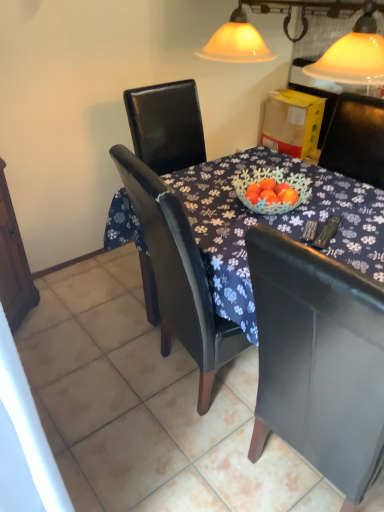
Question: Is point (322, 413) positioned closer to the camera than point (221, 187)?

Choices:
 (A) closer
 (B) farther

Answer: (A)

Question: In terms of width, does black leather chair at center look wider or thinner when compared to dark wood table at center?

Choices:
 (A) wide
 (B) thin

Answer: (B)

Question: Visually, is black leather chair at center positioned to the left or to the right of dark wood table at center?

Choices:
 (A) right
 (B) left

Answer: (A)

Question: In terms of height, does dark wood table at center look taller or shorter compared to black leather chair at center?

Choices:
 (A) tall
 (B) short

Answer: (B)

Question: Visually, is dark wood table at center positioned to the left or to the right of black leather chair at center?

Choices:
 (A) right
 (B) left

Answer: (B)

Question: Does point (256, 162) appear closer or farther from the camera than point (350, 350)?

Choices:
 (A) closer
 (B) farther

Answer: (B)

Question: From a real-world perspective, relative to black leather chair at center, is dark wood table at center vertically above or below?

Choices:
 (A) below
 (B) above

Answer: (B)